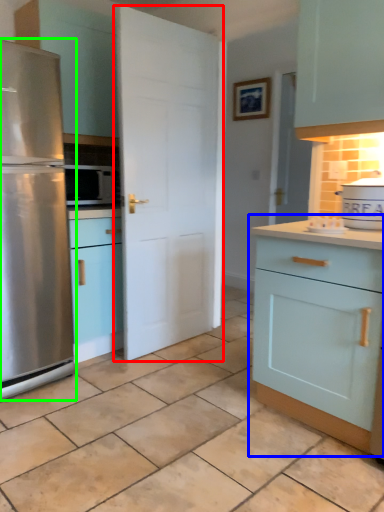
Question: Which object is positioned farthest from door (highlighted by a red box)? Select from cabinetry (highlighted by a blue box) and refrigerator (highlighted by a green box).

Choices:
 (A) cabinetry
 (B) refrigerator

Answer: (A)